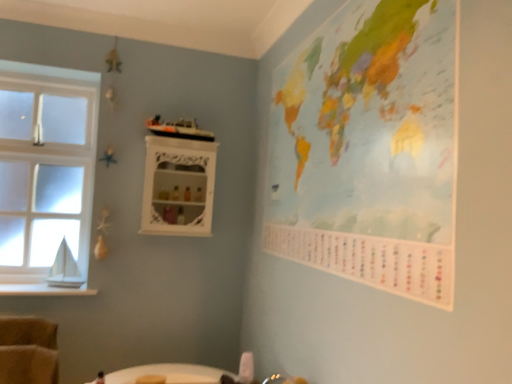
Question: Does point (32, 292) appear closer or farther from the camera than point (389, 231)?

Choices:
 (A) farther
 (B) closer

Answer: (A)

Question: Is white wood at left in front of or behind painted paper map at upper right in the image?

Choices:
 (A) front
 (B) behind

Answer: (B)

Question: Which of these objects is positioned closest to the white glossy cabinet at upper center?

Choices:
 (A) painted paper map at upper right
 (B) white wood at left
 (C) clear glass window at left

Answer: (C)

Question: Which of these objects is positioned farthest from the clear glass window at left?

Choices:
 (A) painted paper map at upper right
 (B) white wood at left
 (C) white glossy cabinet at upper center

Answer: (A)